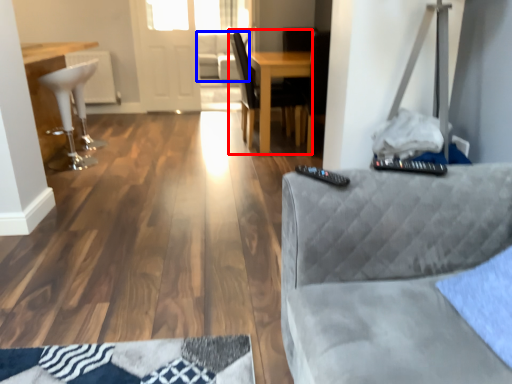
Question: Which of the following is the closest to the observer, chair (highlighted by a red box) or couch (highlighted by a blue box)?

Choices:
 (A) chair
 (B) couch

Answer: (A)